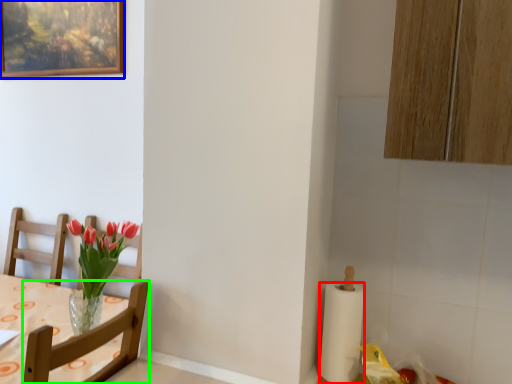
Question: Which object is the closest to the paper towel (highlighted by a red box)? Choose among these: picture frame (highlighted by a blue box) or chair (highlighted by a green box).

Choices:
 (A) picture frame
 (B) chair

Answer: (B)